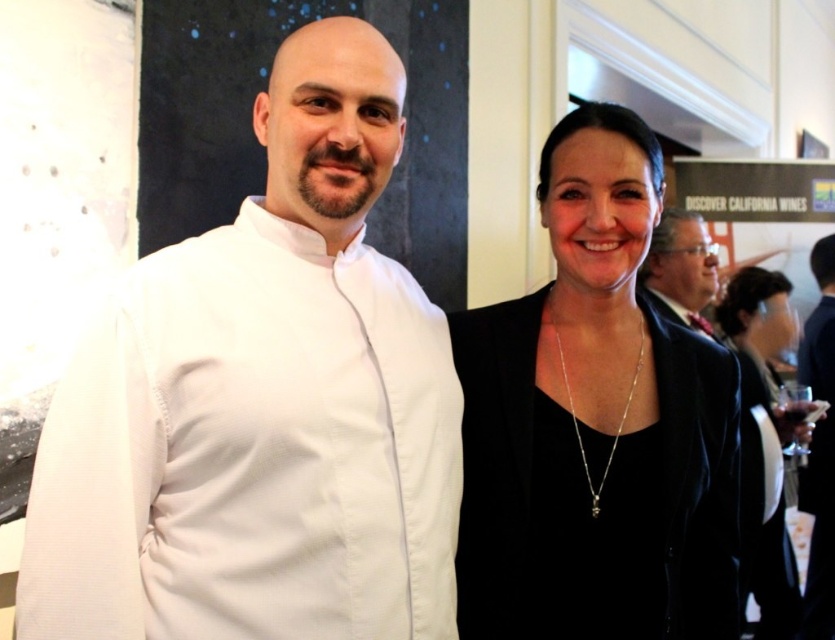
Looking at this image, you are at a party and want to take a photo of the black velvet dress at right and the transparent glass at right. Which object will appear larger in the photo?

The black velvet dress at right will appear larger in the photo because it is closer to the viewer than the transparent glass at right.